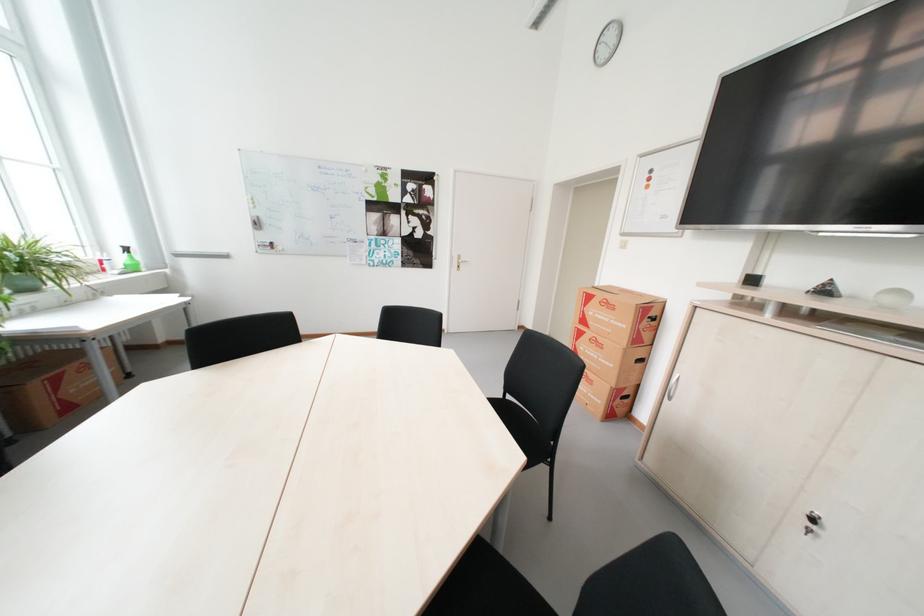
Identify the location of white door handle. [x=458, y=262].